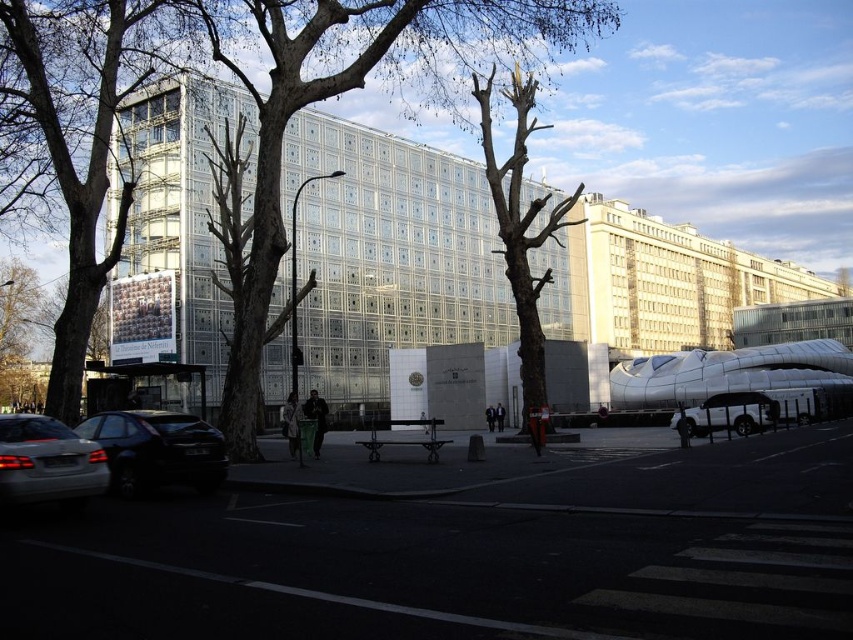
Question: Which object appears farthest from the camera in this image?

Choices:
 (A) bare wood tree at center
 (B) silver metallic car at lower left
 (C) shiny black hatchback at lower left

Answer: (A)

Question: Which of the following is the farthest from the observer?

Choices:
 (A) silver metallic car at lower left
 (B) shiny black hatchback at lower left

Answer: (B)

Question: Which object appears farthest from the camera in this image?

Choices:
 (A) satin silver suv at right
 (B) bare wood tree at center
 (C) shiny black hatchback at lower left

Answer: (B)

Question: Where is bare wood tree at center located in relation to silver metallic car at lower left in the image?

Choices:
 (A) above
 (B) below

Answer: (A)

Question: Is brown bark tree at center to the left of shiny black hatchback at lower left from the viewer's perspective?

Choices:
 (A) yes
 (B) no

Answer: (B)

Question: Considering the relative positions of bare wood tree at center and shiny black hatchback at lower left in the image provided, where is bare wood tree at center located with respect to shiny black hatchback at lower left?

Choices:
 (A) below
 (B) above

Answer: (B)